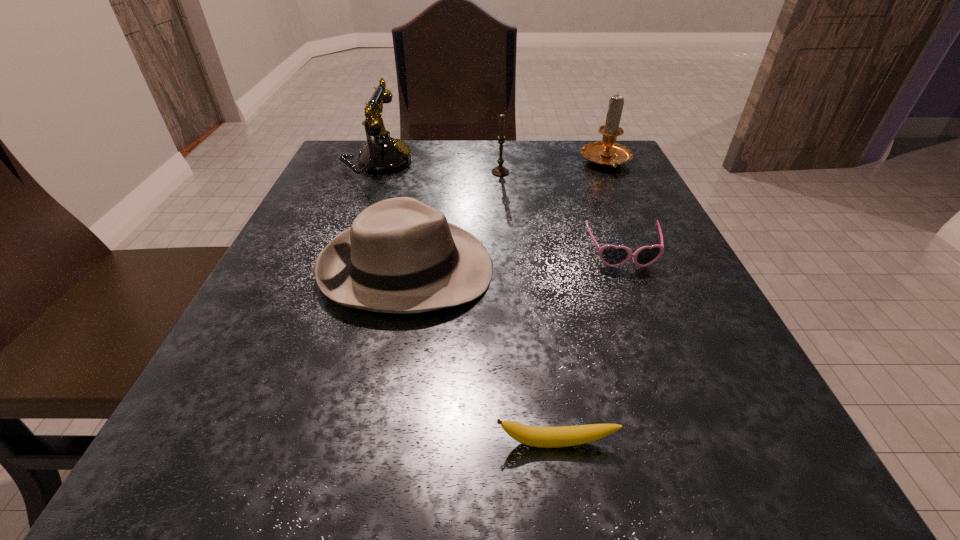
Where is `free space at the far edge of the desktop`? free space at the far edge of the desktop is located at coordinates (418, 166).

In the image, there is a desktop. Identify the location of vacant space at the near edge. This screenshot has width=960, height=540. (536, 450).

In the image, there is a desktop. Identify the location of blank space at the left edge. (297, 303).

Where is `free space at the right edge`? Image resolution: width=960 pixels, height=540 pixels. free space at the right edge is located at coordinates (648, 274).

The width and height of the screenshot is (960, 540). In the image, there is a desktop. Identify the location of free space at the near left corner. (221, 456).

Locate an element on the screen. The width and height of the screenshot is (960, 540). free space at the far right corner is located at coordinates (595, 184).

At what (x,y) coordinates should I click in order to perform the action: click on free spot between the left candle and the telephone. Please return your answer as a coordinate pair (x, y). The image size is (960, 540). Looking at the image, I should click on (439, 167).

Identify the location of free spot between the telephone and the taller candle. This screenshot has height=540, width=960. (492, 163).

Where is `free spot between the left candle and the telephone`? The image size is (960, 540). free spot between the left candle and the telephone is located at coordinates (439, 167).

This screenshot has height=540, width=960. Identify the location of empty space that is in between the left candle and the taller candle. (553, 167).